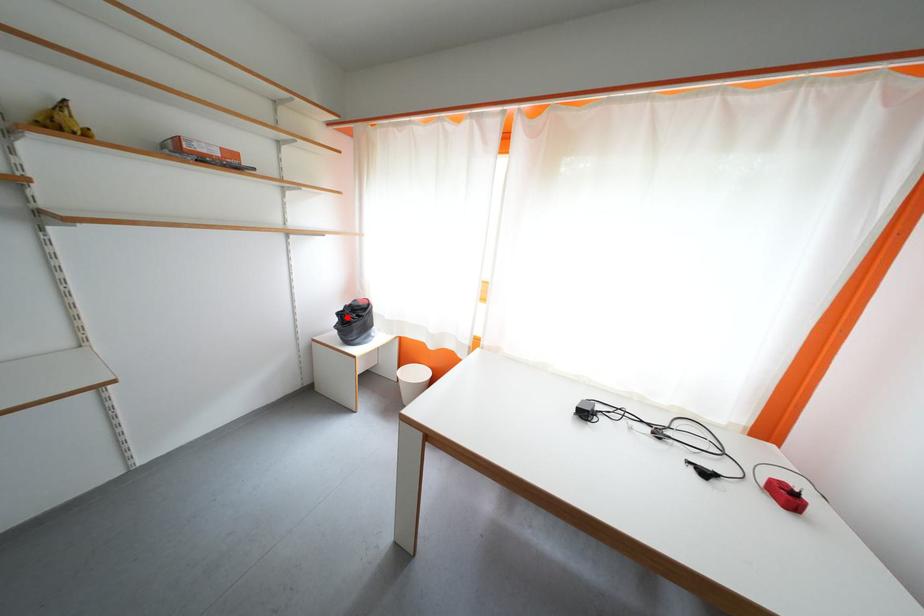
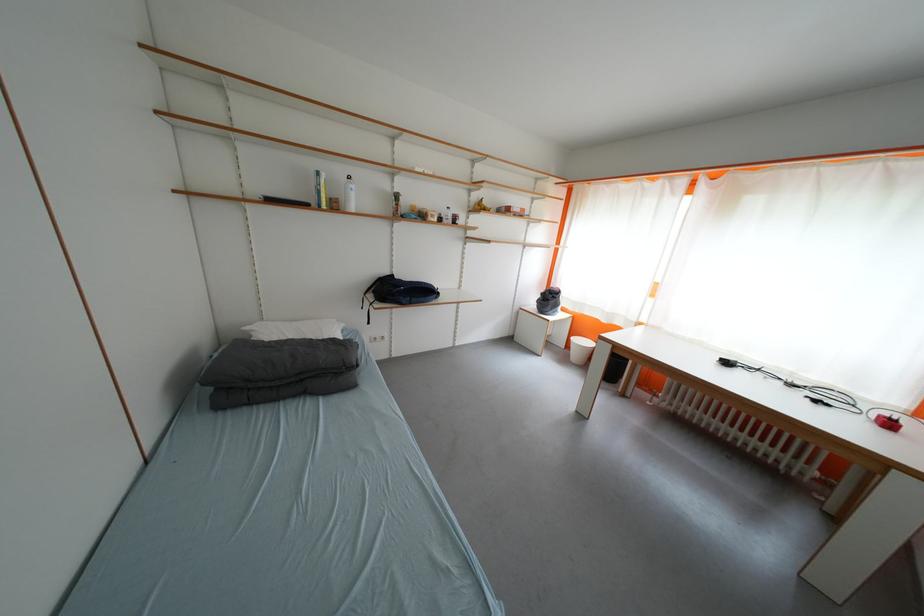
Question: I am providing you with two images of the same scene from different viewpoints. Image1 has a red point marked. In image2, the corresponding 3D location appears at what relative position? Reply with the corresponding letter.

Choices:
 (A) Closer
 (B) Farther

Answer: (A)